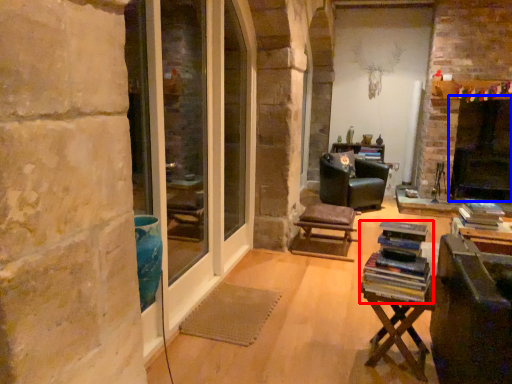
Question: Which of the following is the closest to the observer, book (highlighted by a red box) or fireplace (highlighted by a blue box)?

Choices:
 (A) book
 (B) fireplace

Answer: (A)